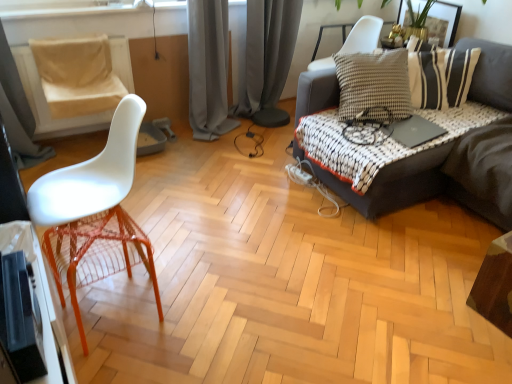
What do you see at coordinates (443, 22) in the screenshot? This screenshot has width=512, height=384. I see `gold metallic picture frame at upper right` at bounding box center [443, 22].

The image size is (512, 384). I want to click on gold metallic picture frame at upper right, so click(443, 22).

What do you see at coordinates (46, 102) in the screenshot? This screenshot has height=384, width=512. I see `beige fabric swivel chair at left` at bounding box center [46, 102].

Identify the location of gray fabric curtain at center, which is the 1th curtain from left to right. (208, 68).

Consider the image. What is the approximate width of gray velvet curtain at center, the first curtain from the right?

The width of gray velvet curtain at center, the first curtain from the right, is 11.18 inches.

Describe the element at coordinates (495, 285) in the screenshot. I see `wooden table at lower right` at that location.

In order to face black matte laptop at upper right, should I rotate leftwards or rightwards?

Rotate your view right by about 20.324°.

In order to click on gold metallic picture frame at upper right in this screenshot , I will do `click(443, 22)`.

From a real-world perspective, relative to white plastic chair at left, is gray velvet curtain at center, the 2th curtain from the left, vertically above or below?

Clearly, from a real-world perspective, gray velvet curtain at center, the 2th curtain from the left, is above white plastic chair at left.

Is point (274, 122) farther from viewer compared to point (100, 165)?

That is True.

Who is more distant, gray velvet curtain at center, the first curtain from the right, or white plastic chair at left?

gray velvet curtain at center, the first curtain from the right, is further away from the camera.

Considering the sizes of objects gray velvet curtain at center, the 2th curtain from the left, and white plastic chair at left in the image provided, who is bigger, gray velvet curtain at center, the 2th curtain from the left, or white plastic chair at left?

With larger size is white plastic chair at left.

Is gold metallic picture frame at upper right oriented away from gray velvet curtain at center, the 2th curtain from the left?

gold metallic picture frame at upper right does not have its back to gray velvet curtain at center, the 2th curtain from the left.

The image size is (512, 384). What are the coordinates of `the 1st curtain in front of the gold metallic picture frame at upper right` in the screenshot? It's located at (268, 59).

Is gold metallic picture frame at upper right not close to gray velvet curtain at center, the 2th curtain from the left?

Yes, gold metallic picture frame at upper right and gray velvet curtain at center, the 2th curtain from the left, are quite far apart.

In the scene shown: Considering the relative positions of gold metallic picture frame at upper right and gray velvet curtain at center, the 2th curtain from the left, in the image provided, is gold metallic picture frame at upper right to the right of gray velvet curtain at center, the 2th curtain from the left, from the viewer's perspective?

Yes.

Is gray velvet curtain at center, the 2th curtain from the left, with dark gray fabric couch at right?

No, gray velvet curtain at center, the 2th curtain from the left, is not in contact with dark gray fabric couch at right.

Considering the positions of objects gray velvet curtain at center, the first curtain from the right, and dark gray fabric couch at right in the image provided, who is more to the right, gray velvet curtain at center, the first curtain from the right, or dark gray fabric couch at right?

Positioned to the right is dark gray fabric couch at right.

Does point (275, 49) come farther from viewer compared to point (359, 205)?

Yes, it is.

Considering the relative sizes of white plastic chair at left and gray velvet curtain at center, the 2th curtain from the left, in the image provided, is white plastic chair at left taller than gray velvet curtain at center, the 2th curtain from the left,?

No, white plastic chair at left is not taller than gray velvet curtain at center, the 2th curtain from the left.

How different are the orientations of white plastic chair at left and gray velvet curtain at center, the 2th curtain from the left, in degrees?

There is a 88.1-degree angle between the facing directions of white plastic chair at left and gray velvet curtain at center, the 2th curtain from the left.

There is a white plastic chair at left. Where is `the 2nd curtain above it (from the image's perspective)`? The height and width of the screenshot is (384, 512). the 2nd curtain above it (from the image's perspective) is located at coordinates (268, 59).

Is white plastic chair at left bigger than gray velvet curtain at center, the first curtain from the right?

Yes.

Would you say beige fabric swivel chair at left contains gray fabric curtain at center, the 2th curtain from the right?

No, gray fabric curtain at center, the 2th curtain from the right, is not surrounded by beige fabric swivel chair at left.

From a real-world perspective, between beige fabric swivel chair at left and gray fabric curtain at center, which is the 1th curtain from left to right, who is vertically lower?

beige fabric swivel chair at left is physically lower.

Can you confirm if beige fabric swivel chair at left is positioned to the left of gray fabric curtain at center, which is the 1th curtain from left to right?

Correct, you'll find beige fabric swivel chair at left to the left of gray fabric curtain at center, which is the 1th curtain from left to right.

From the image's perspective, is beige fabric swivel chair at left beneath gray fabric curtain at center, which is the 1th curtain from left to right?

Correct, beige fabric swivel chair at left appears lower than gray fabric curtain at center, which is the 1th curtain from left to right, in the image.

Is beige fabric swivel chair at left further to the viewer compared to black matte laptop at upper right?

That is True.

Which of these two, beige fabric swivel chair at left or black matte laptop at upper right, stands shorter?

black matte laptop at upper right.

Locate an element on the screen. This screenshot has width=512, height=384. laptop lying on the right of beige fabric swivel chair at left is located at coordinates (415, 131).

Who is bigger, dark gray fabric couch at right or gold metallic picture frame at upper right?

Bigger between the two is dark gray fabric couch at right.

From the image's perspective, which object appears higher, dark gray fabric couch at right or gold metallic picture frame at upper right?

gold metallic picture frame at upper right, from the image's perspective.

Considering the sizes of objects dark gray fabric couch at right and gold metallic picture frame at upper right in the image provided, who is shorter, dark gray fabric couch at right or gold metallic picture frame at upper right?

gold metallic picture frame at upper right is shorter.

Can you confirm if dark gray fabric couch at right is thinner than gold metallic picture frame at upper right?

No, dark gray fabric couch at right is not thinner than gold metallic picture frame at upper right.

In the image, there is a gray velvet curtain at center, the 2th curtain from the left. Find the location of `chair below it (from a real-world perspective)`. chair below it (from a real-world perspective) is located at coordinates (94, 213).

Image resolution: width=512 pixels, height=384 pixels. I want to click on the 1st curtain in front of the gold metallic picture frame at upper right, starting your count from the anchor, so click(x=268, y=59).

When comparing their distances from beige fabric swivel chair at left, does white plastic chair at left or black matte laptop at upper right seem further?

Among the two, black matte laptop at upper right is located further to beige fabric swivel chair at left.

Based on their spatial positions, is beige fabric swivel chair at left or gold metallic picture frame at upper right closer to white plastic chair at left?

beige fabric swivel chair at left lies closer to white plastic chair at left than the other object.

When comparing their distances from gray fabric curtain at center, which is the 1th curtain from left to right, does dark gray fabric couch at right or wooden table at lower right seem further?

Among the two, wooden table at lower right is located further to gray fabric curtain at center, which is the 1th curtain from left to right.

Looking at the image, which one is located closer to white plastic chair at left, dark gray fabric couch at right or wooden table at lower right?

Based on the image, dark gray fabric couch at right appears to be nearer to white plastic chair at left.

When comparing their distances from wooden table at lower right, does gold metallic picture frame at upper right or gray fabric curtain at center, the 2th curtain from the right, seem closer?

The object closer to wooden table at lower right is gray fabric curtain at center, the 2th curtain from the right.

From the image, which object appears to be farther from black matte laptop at upper right, dark gray fabric couch at right or white plastic chair at left?

white plastic chair at left.

Based on their spatial positions, is dark gray fabric couch at right or wooden table at lower right closer to gray velvet curtain at center, the first curtain from the right?

dark gray fabric couch at right is positioned closer to the anchor gray velvet curtain at center, the first curtain from the right.

Based on their spatial positions, is white plastic chair at left or gray fabric curtain at center, the 2th curtain from the right, closer to gray velvet curtain at center, the 2th curtain from the left?

gray fabric curtain at center, the 2th curtain from the right, is positioned closer to the anchor gray velvet curtain at center, the 2th curtain from the left.

Where is `laptop that lies between gray velvet curtain at center, the first curtain from the right, and wooden table at lower right from top to bottom`? This screenshot has height=384, width=512. laptop that lies between gray velvet curtain at center, the first curtain from the right, and wooden table at lower right from top to bottom is located at coordinates (415, 131).

Locate an element on the screen. This screenshot has height=384, width=512. curtain between white plastic chair at left and beige fabric swivel chair at left in the front-back direction is located at coordinates (208, 68).

At what (x,y) coordinates should I click in order to perform the action: click on curtain between gray fabric curtain at center, which is the 1th curtain from left to right, and black matte laptop at upper right, in the horizontal direction. Please return your answer as a coordinate pair (x, y). Looking at the image, I should click on (268, 59).

Find the location of a particular element. The image size is (512, 384). curtain between beige fabric swivel chair at left and gray velvet curtain at center, the 2th curtain from the left, in the horizontal direction is located at coordinates (208, 68).